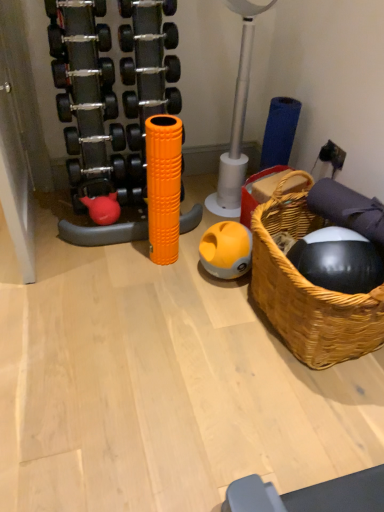
Identify the location of free space to the left of orange foam roller at center. (131, 256).